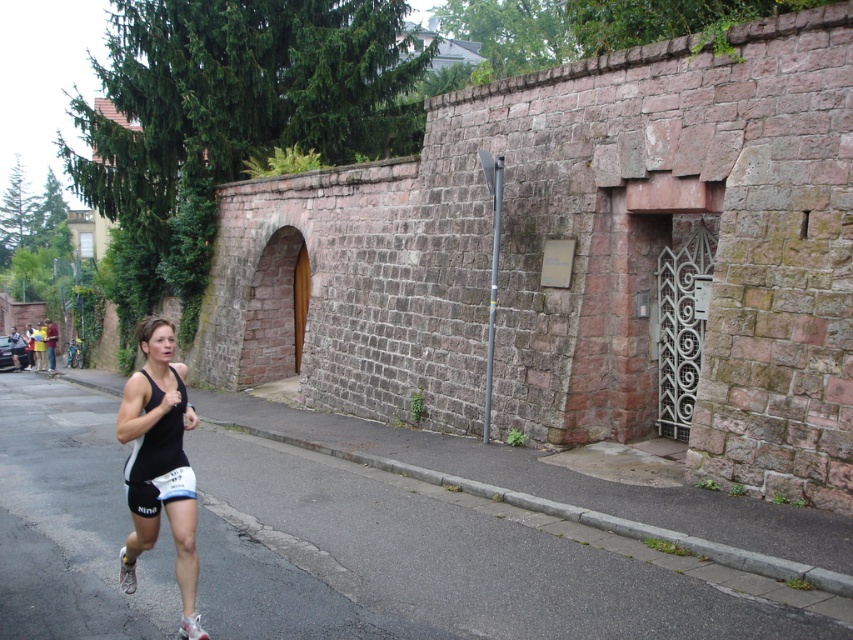
Question: Considering the relative positions of black fabric runner at lower left and black matte tank top at lower left in the image provided, where is black fabric runner at lower left located with respect to black matte tank top at lower left?

Choices:
 (A) above
 (B) below

Answer: (B)

Question: Which object appears closest to the camera in this image?

Choices:
 (A) black matte tank top at lower left
 (B) black fabric runner at lower left

Answer: (A)

Question: Is black fabric runner at lower left wider than black matte tank top at lower left?

Choices:
 (A) no
 (B) yes

Answer: (B)

Question: Does black fabric runner at lower left appear under black matte tank top at lower left?

Choices:
 (A) yes
 (B) no

Answer: (A)